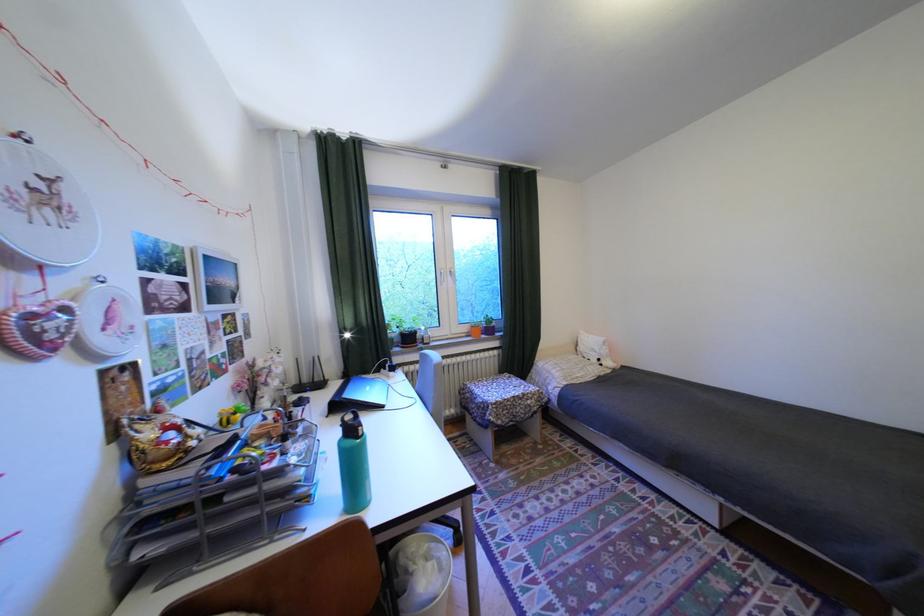
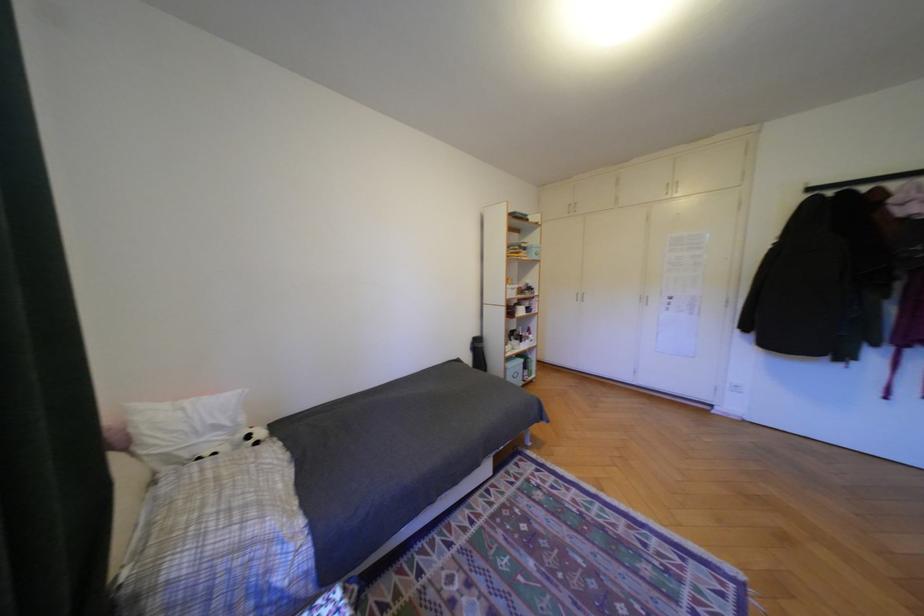
Where in the second image is the point corresponding to point 611,360 from the first image?

(261, 437)